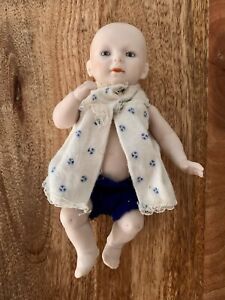
Where is `doll`? The image size is (225, 300). doll is located at coordinates [141, 139].